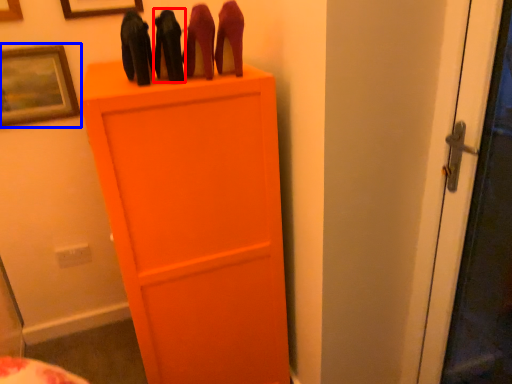
Question: Which object appears closest to the camera in this image, stuff (highlighted by a red box) or picture frame (highlighted by a blue box)?

Choices:
 (A) stuff
 (B) picture frame

Answer: (A)